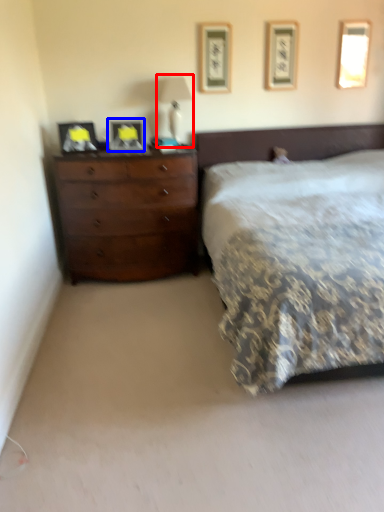
Question: Which point is closer to the camera, bedside lamp (highlighted by a red box) or picture frame (highlighted by a blue box)?

Choices:
 (A) bedside lamp
 (B) picture frame

Answer: (B)